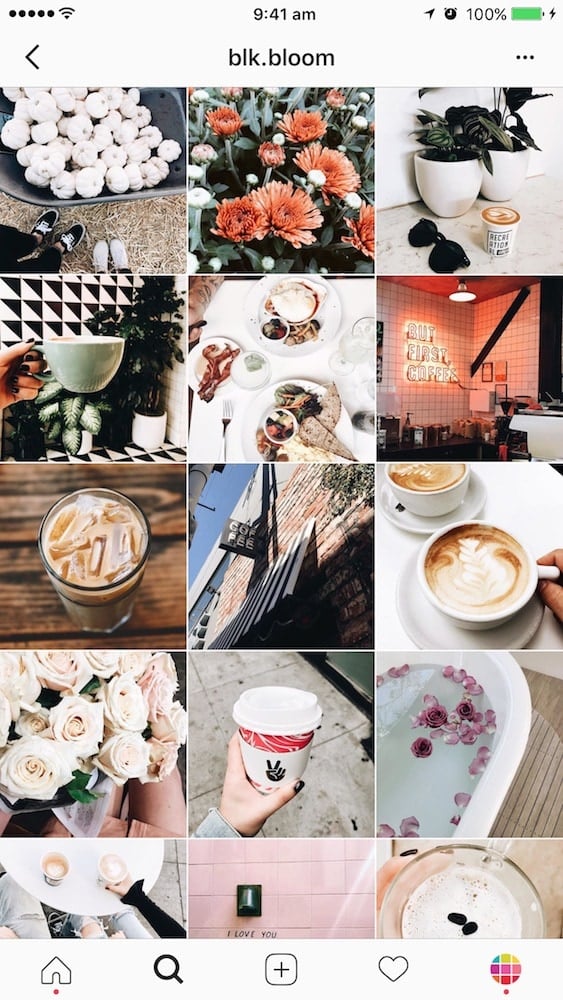
At what (x,y) coordinates should I click in order to perform the action: click on orange flowers. Please return your answer as a coordinate pair (x, y). The height and width of the screenshot is (1000, 563). Looking at the image, I should click on (233, 118), (233, 88), (190, 88), (334, 100), (312, 119), (277, 154), (328, 164), (302, 211), (233, 219).